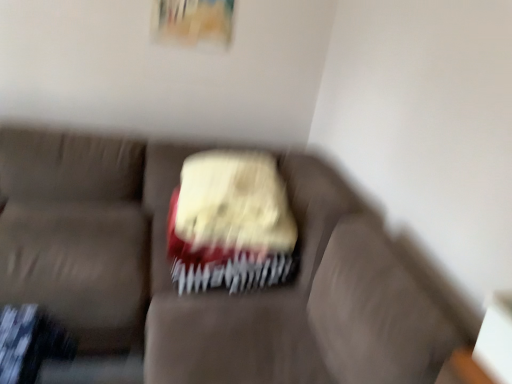
Question: Considering the relative sizes of white textured cake at center and matte fabric couch at center in the image provided, is white textured cake at center shorter than matte fabric couch at center?

Choices:
 (A) no
 (B) yes

Answer: (B)

Question: Would you say white textured cake at center contains matte fabric couch at center?

Choices:
 (A) yes
 (B) no

Answer: (B)

Question: Is white textured cake at center positioned before matte fabric couch at center?

Choices:
 (A) yes
 (B) no

Answer: (B)

Question: Can you confirm if white textured cake at center is taller than matte fabric couch at center?

Choices:
 (A) no
 (B) yes

Answer: (A)

Question: Is white textured cake at center at the right side of matte fabric couch at center?

Choices:
 (A) yes
 (B) no

Answer: (A)

Question: Is white textured cake at center at the left side of matte fabric couch at center?

Choices:
 (A) no
 (B) yes

Answer: (A)

Question: From the image's perspective, is matte fabric couch at center on top of white textured cake at center?

Choices:
 (A) no
 (B) yes

Answer: (A)

Question: From a real-world perspective, is matte fabric couch at center located beneath white textured cake at center?

Choices:
 (A) yes
 (B) no

Answer: (A)

Question: Does matte fabric couch at center turn towards white textured cake at center?

Choices:
 (A) no
 (B) yes

Answer: (A)

Question: Considering the relative sizes of matte fabric couch at center and white textured cake at center in the image provided, is matte fabric couch at center shorter than white textured cake at center?

Choices:
 (A) no
 (B) yes

Answer: (A)

Question: Considering the relative sizes of matte fabric couch at center and white textured cake at center in the image provided, is matte fabric couch at center taller than white textured cake at center?

Choices:
 (A) no
 (B) yes

Answer: (B)

Question: Can you confirm if matte fabric couch at center is smaller than white textured cake at center?

Choices:
 (A) yes
 (B) no

Answer: (B)

Question: Which is correct: white textured cake at center is inside matte fabric couch at center, or outside of it?

Choices:
 (A) inside
 (B) outside

Answer: (A)